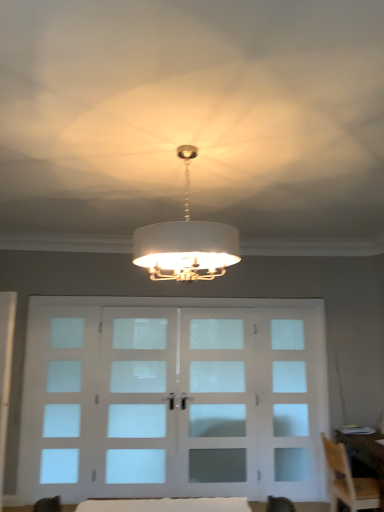
Question: From the image's perspective, is clear glass door at center, acting as the 2th screen door starting from the right, positioned above or below white fabric table at lower center?

Choices:
 (A) above
 (B) below

Answer: (B)

Question: In terms of size, does clear glass door at center, arranged as the 1th screen door when viewed from the left, appear bigger or smaller than white fabric table at lower center?

Choices:
 (A) big
 (B) small

Answer: (A)

Question: Which object is positioned farthest from the clear glass door at center, placed as the first screen door when sorted from right to left?

Choices:
 (A) white fabric table at lower center
 (B) frosted glass window at left
 (C) wooden chair at lower right
 (D) clear glass door at center, arranged as the 1th screen door when viewed from the left
 (E) white fabric lampshade at center

Answer: (E)

Question: Which is nearer to the white fabric table at lower center?

Choices:
 (A) clear glass door at center, acting as the 2th screen door starting from the right
 (B) wooden chair at lower right
 (C) frosted glass window at left
 (D) white fabric lampshade at center
 (E) clear glass door at center, acting as the 2th screen door starting from the left

Answer: (B)